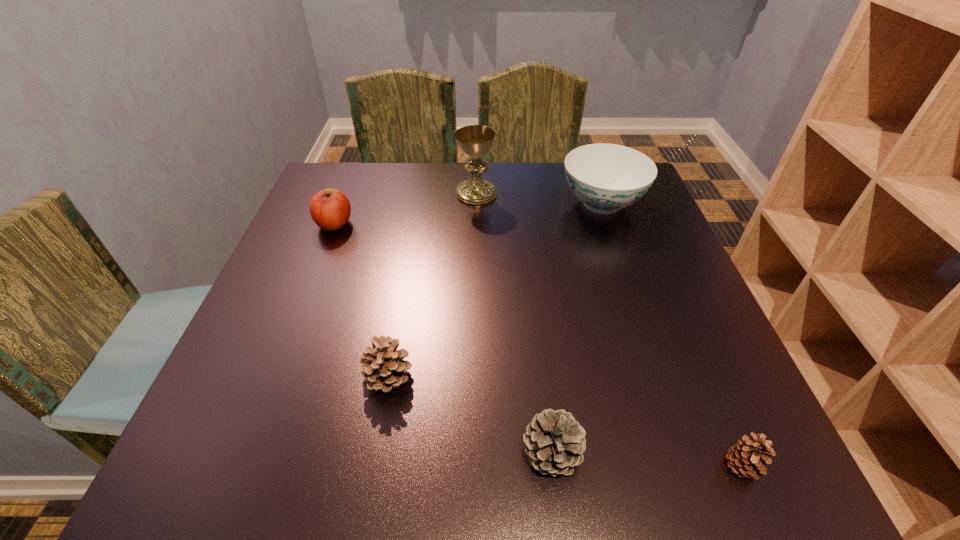
You are a GUI agent. You are given a task and a screenshot of the screen. Output one action in this format:
    pyautogui.click(x=<x>, y=<y>)
    Task: Click on the object that is at the far right corner
    The height and width of the screenshot is (540, 960).
    Given the screenshot: What is the action you would take?
    pyautogui.click(x=606, y=177)

Where is `object at the near right corner`? The image size is (960, 540). object at the near right corner is located at coordinates (747, 457).

Find the location of a particular element. The image size is (960, 540). vacant space at the far edge is located at coordinates (482, 177).

Where is `vacant space at the near edge`? vacant space at the near edge is located at coordinates (501, 437).

Where is `vacant space at the left edge`? vacant space at the left edge is located at coordinates (264, 394).

You are a GUI agent. You are given a task and a screenshot of the screen. Output one action in this format:
    pyautogui.click(x=<x>, y=<y>)
    Task: Click on the vacant point at the right edge
    Image resolution: width=960 pixels, height=540 pixels.
    Given the screenshot: What is the action you would take?
    pyautogui.click(x=636, y=278)

Find the location of a particular element. This screenshot has width=960, height=540. unoccupied position between the fourth farthest object and the chinaware is located at coordinates (494, 289).

This screenshot has height=540, width=960. What are the coordinates of `free space between the chinaware and the fifth object from right to left` in the screenshot? It's located at (494, 289).

Locate an element on the screen. This screenshot has height=540, width=960. vacant space that's between the second pinecone from left to right and the apple is located at coordinates (444, 339).

The height and width of the screenshot is (540, 960). I want to click on free space between the chalice and the second pinecone from right to left, so click(x=514, y=323).